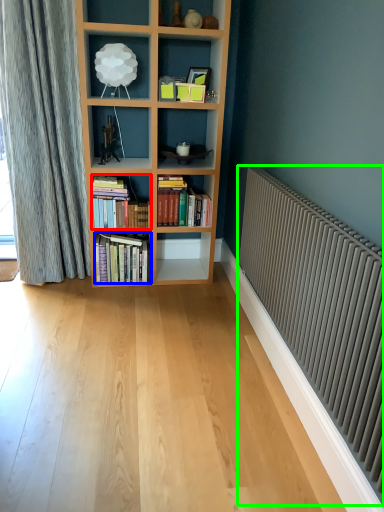
Question: Considering the real-world distances, which object is farthest from book (highlighted by a red box)? book (highlighted by a blue box) or radiator (highlighted by a green box)?

Choices:
 (A) book
 (B) radiator

Answer: (B)